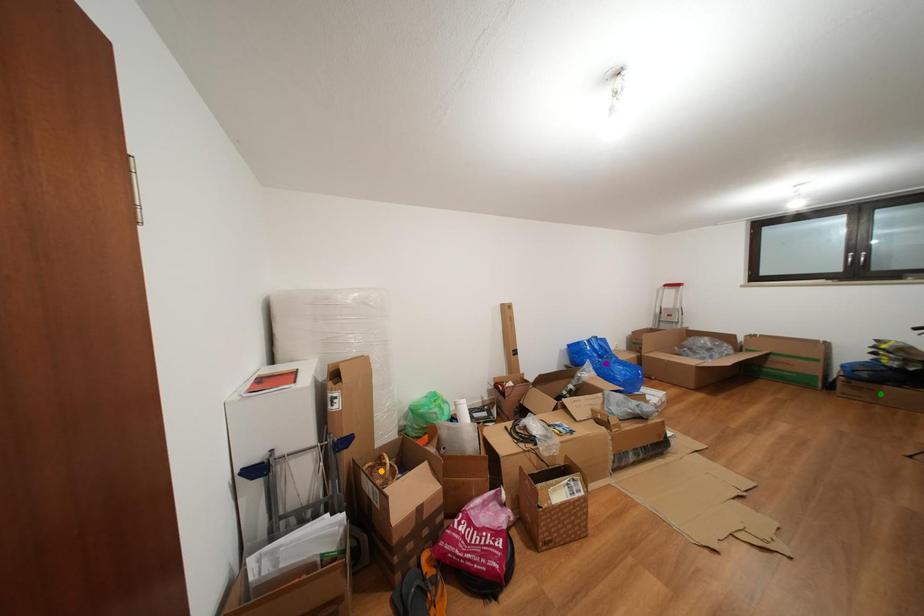
Looking at this image, order these from nearest to farthest:
orange point, purple point, green point

green point, orange point, purple point